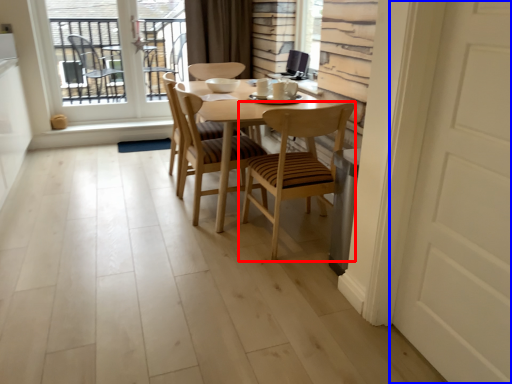
Question: Which point is further to the camera, chair (highlighted by a red box) or door (highlighted by a blue box)?

Choices:
 (A) chair
 (B) door

Answer: (A)